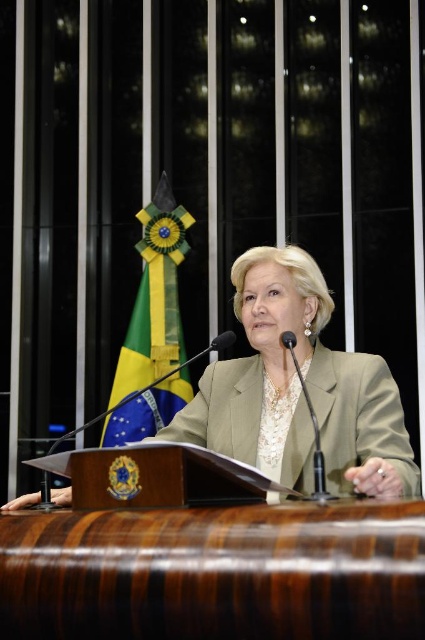
Is matte beige blazer at center in front of yellow-green fabric flag at left?

That is True.

Does point (198, 401) lie behind point (176, 252)?

No, it is in front of (176, 252).

Where is `matte beige blazer at center`? matte beige blazer at center is located at coordinates (359, 417).